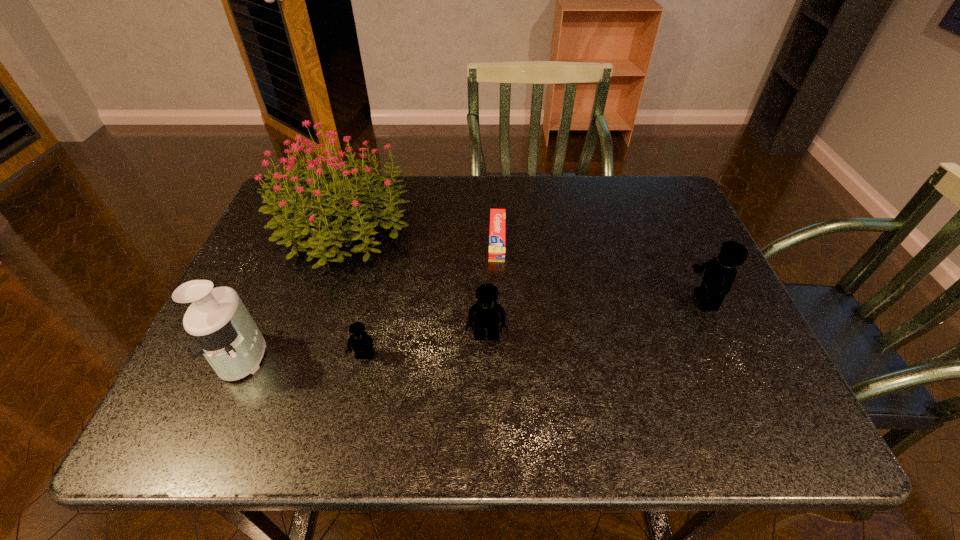
Find the location of `vacant space located 0.060m on the front-facing side of the farthest Lego`. vacant space located 0.060m on the front-facing side of the farthest Lego is located at coordinates (664, 300).

Identify the location of vacant space situated 0.260m on the front-facing side of the farthest Lego. (579, 300).

The width and height of the screenshot is (960, 540). What are the coordinates of `free space located on the front-facing side of the farthest Lego` in the screenshot? It's located at (533, 300).

I want to click on vacant space located 0.390m on the right of the tallest object, so click(551, 228).

Identify the location of free space located 0.320m on the left of the toothpaste. (370, 239).

You are a GUI agent. You are given a task and a screenshot of the screen. Output one action in this format:
    pyautogui.click(x=<x>, y=<y>)
    Task: Click on the free space located on the right of the fifth shortest object
    The width and height of the screenshot is (960, 540).
    Given the screenshot: What is the action you would take?
    pyautogui.click(x=308, y=356)

At what (x,y) coordinates should I click in order to perform the action: click on bouquet that is at the far edge. Please return your answer as a coordinate pair (x, y). This screenshot has height=540, width=960. Looking at the image, I should click on (298, 210).

Locate an element on the screen. This screenshot has width=960, height=540. toothpaste located in the far edge section of the desktop is located at coordinates (497, 216).

Identify the location of Lego at the near edge. The image size is (960, 540). (362, 344).

Where is `juicer that is at the near edge`? Image resolution: width=960 pixels, height=540 pixels. juicer that is at the near edge is located at coordinates click(225, 333).